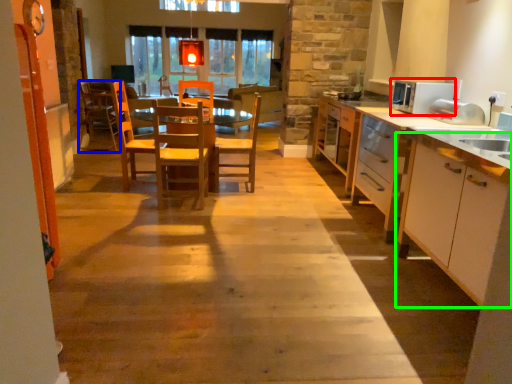
Question: Which object is positioned farthest from appliance (highlighted by a red box)? Select from chair (highlighted by a blue box) and cabinetry (highlighted by a green box).

Choices:
 (A) chair
 (B) cabinetry

Answer: (A)